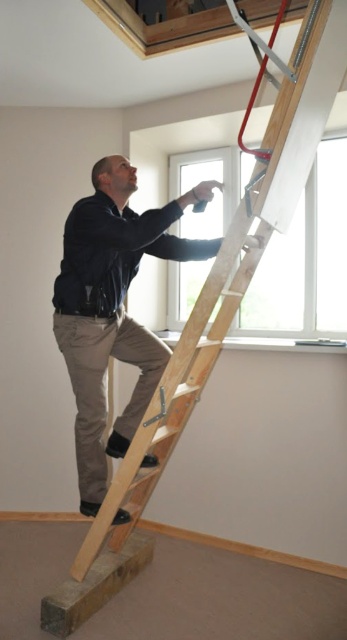
In the scene shown: You are a painter who needs to climb the wooden ladder at center to reach the slanted ceiling. However, you notice the dark brown leather jacket at upper center is in the way. Is the jacket positioned above or below the ladder?

The dark brown leather jacket at upper center is below the wooden ladder at center, so it is positioned below the ladder.

You are standing in the room and want to reach a point marked as point (88,236). You have a 2.5 meter ladder. Will the ladder be long enough to reach that point?

The point (88,236) is 2.21 meters from the viewer. Since the ladder is 2.5 meters long, it is longer than the required distance, so yes, the ladder will be long enough to reach the point.